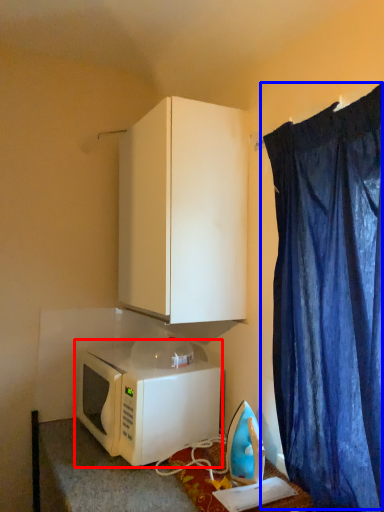
Question: Among these objects, which one is nearest to the camera, microwave oven (highlighted by a red box) or curtain (highlighted by a blue box)?

Choices:
 (A) microwave oven
 (B) curtain

Answer: (B)